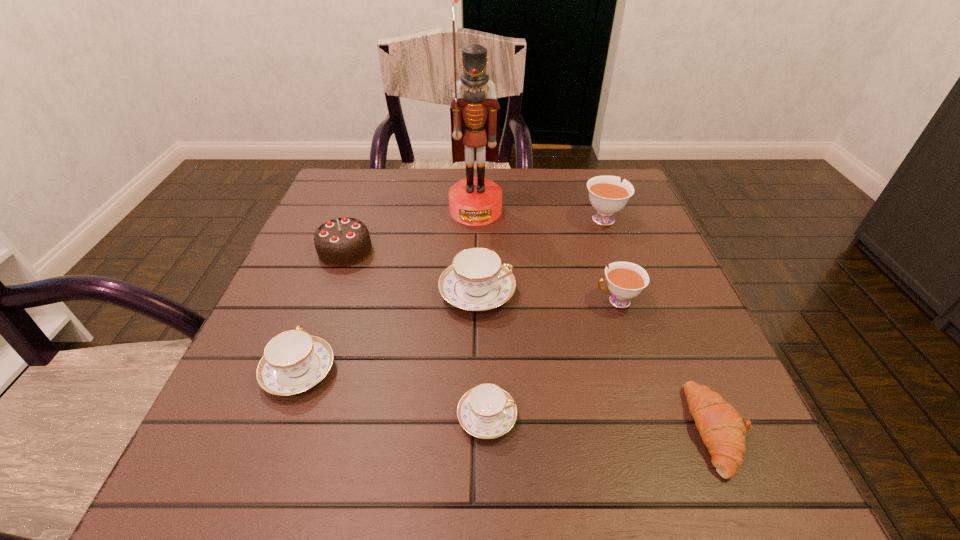
The height and width of the screenshot is (540, 960). Identify the location of teacup present at the left edge. (294, 361).

Locate an element on the screen. The width and height of the screenshot is (960, 540). crescent roll positioned at the right edge is located at coordinates (721, 427).

Locate an element on the screen. The height and width of the screenshot is (540, 960). object present at the far right corner is located at coordinates (607, 194).

At what (x,y) coordinates should I click in order to perform the action: click on object that is positioned at the near right corner. Please return your answer as a coordinate pair (x, y). The image size is (960, 540). Looking at the image, I should click on (721, 427).

In the image, there is a desktop. Where is `free region at the far edge`? This screenshot has height=540, width=960. free region at the far edge is located at coordinates (569, 195).

Where is `free space at the near edge of the desktop`? free space at the near edge of the desktop is located at coordinates (644, 508).

Image resolution: width=960 pixels, height=540 pixels. In order to click on free space at the left edge in this screenshot , I will do `click(220, 437)`.

Identify the location of free space at the right edge of the desktop. The width and height of the screenshot is (960, 540). (667, 256).

The image size is (960, 540). I want to click on vacant area at the far left corner of the desktop, so (x=344, y=187).

Find the location of `vacant space in between the chocolate cake and the farther white teacup`. vacant space in between the chocolate cake and the farther white teacup is located at coordinates (474, 234).